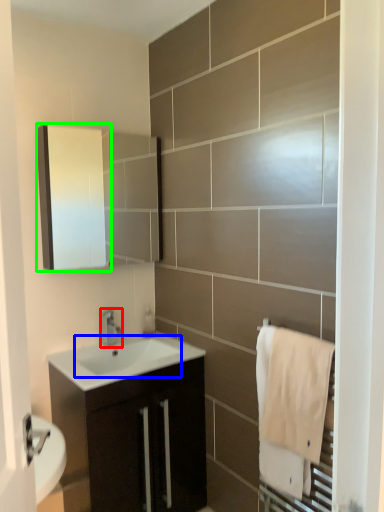
Question: Which is nearer to the tap (highlighted by a red box)? sink (highlighted by a blue box) or medicine cabinet (highlighted by a green box).

Choices:
 (A) sink
 (B) medicine cabinet

Answer: (A)